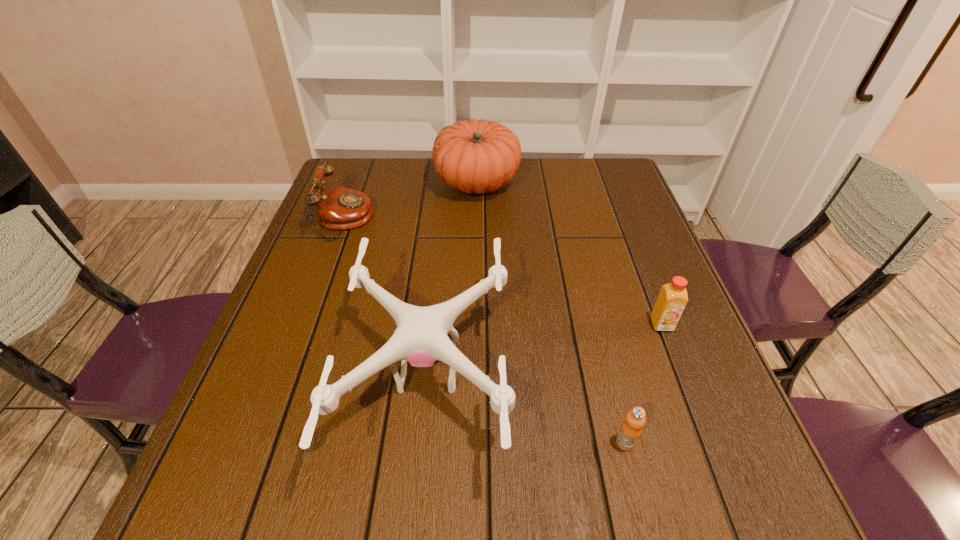
This screenshot has height=540, width=960. I want to click on pumpkin, so click(x=474, y=156).

The width and height of the screenshot is (960, 540). Identify the location of drone. point(421,339).

Find the location of a particular element. The height and width of the screenshot is (540, 960). telephone is located at coordinates (338, 208).

Where is `the taller orange juice`? the taller orange juice is located at coordinates (672, 299).

You are a GUI agent. You are given a task and a screenshot of the screen. Output one action in this format:
    pyautogui.click(x=<x>, y=<y>)
    Task: Click on the right orange juice
    Image resolution: width=960 pixels, height=540 pixels.
    Given the screenshot: What is the action you would take?
    pyautogui.click(x=672, y=299)

Identify the location of the shorter orange juice. The height and width of the screenshot is (540, 960). (630, 431).

This screenshot has height=540, width=960. I want to click on the nearer orange juice, so click(x=630, y=431).

In order to click on vacant point located on the left of the pumpkin in this screenshot , I will do `click(386, 183)`.

Locate an element on the screen. The image size is (960, 540). vacant space located on the top of the drone is located at coordinates 559,373.

Identify the location of free space located on the dial of the telephone. (496, 220).